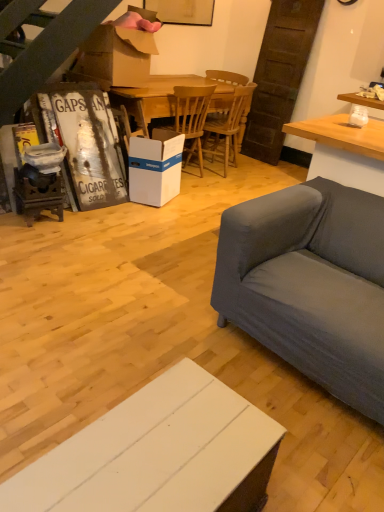
Question: Considering the relative sizes of wooden at center, which is the second chair in right-to-left order, and brown cardboard box at upper center in the image provided, is wooden at center, which is the second chair in right-to-left order, thinner than brown cardboard box at upper center?

Choices:
 (A) no
 (B) yes

Answer: (A)

Question: Is wooden at center, which is the second chair in right-to-left order, smaller than brown cardboard box at upper center?

Choices:
 (A) no
 (B) yes

Answer: (A)

Question: Does wooden at center, which is the second chair in right-to-left order, come in front of brown cardboard box at upper center?

Choices:
 (A) yes
 (B) no

Answer: (B)

Question: Considering the relative sizes of wooden at center, positioned as the 1th chair in left-to-right order, and brown cardboard box at upper center in the image provided, is wooden at center, positioned as the 1th chair in left-to-right order, wider than brown cardboard box at upper center?

Choices:
 (A) yes
 (B) no

Answer: (A)

Question: From a real-world perspective, does wooden at center, positioned as the 1th chair in left-to-right order, sit lower than brown cardboard box at upper center?

Choices:
 (A) yes
 (B) no

Answer: (A)

Question: Can you confirm if wooden at center, which is the second chair in right-to-left order, is bigger than brown cardboard box at upper center?

Choices:
 (A) no
 (B) yes

Answer: (B)

Question: Is white wood cabinet at lower center turned away from wooden at center, positioned as the 1th chair in left-to-right order?

Choices:
 (A) yes
 (B) no

Answer: (B)

Question: Are white wood cabinet at lower center and wooden at center, which is the second chair in right-to-left order, making contact?

Choices:
 (A) yes
 (B) no

Answer: (B)

Question: Does white wood cabinet at lower center have a lesser width compared to wooden at center, positioned as the 1th chair in left-to-right order?

Choices:
 (A) yes
 (B) no

Answer: (A)

Question: Is the depth of white wood cabinet at lower center greater than that of wooden at center, which is the second chair in right-to-left order?

Choices:
 (A) yes
 (B) no

Answer: (B)

Question: Is white wood cabinet at lower center not within wooden at center, which is the second chair in right-to-left order?

Choices:
 (A) yes
 (B) no

Answer: (A)

Question: Are white wood cabinet at lower center and wooden at center, positioned as the 1th chair in left-to-right order, far apart?

Choices:
 (A) yes
 (B) no

Answer: (A)

Question: Can you confirm if wooden table at center is wider than white cardboard box at center?

Choices:
 (A) yes
 (B) no

Answer: (A)